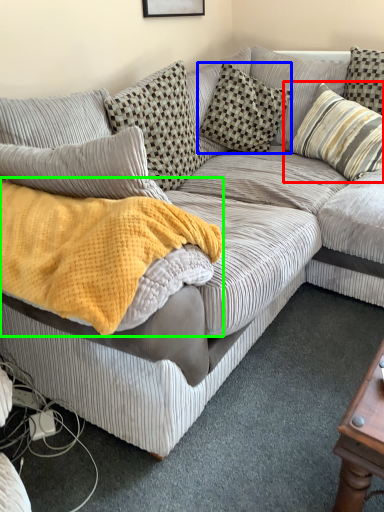
Question: Based on their relative distances, which object is nearer to pillow (highlighted by a red box)? Choose from pillow (highlighted by a blue box) and blanket (highlighted by a green box).

Choices:
 (A) pillow
 (B) blanket

Answer: (A)